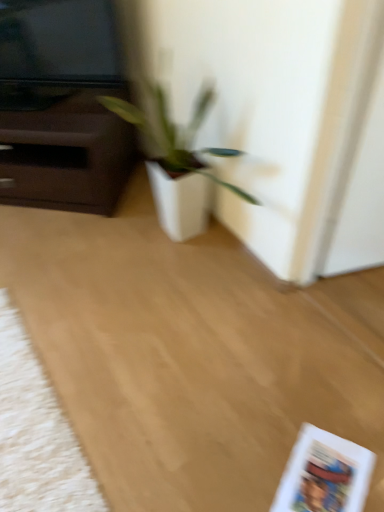
Where is `vacant space behind white fluffy mat at lower left`? The width and height of the screenshot is (384, 512). vacant space behind white fluffy mat at lower left is located at coordinates (52, 295).